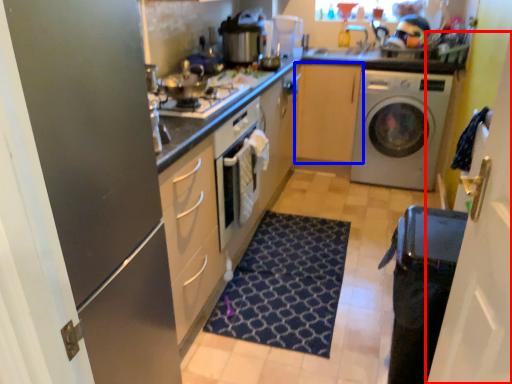
Question: Which object is closer to the camera taking this photo, glass door (highlighted by a red box) or cabinetry (highlighted by a blue box)?

Choices:
 (A) glass door
 (B) cabinetry

Answer: (A)